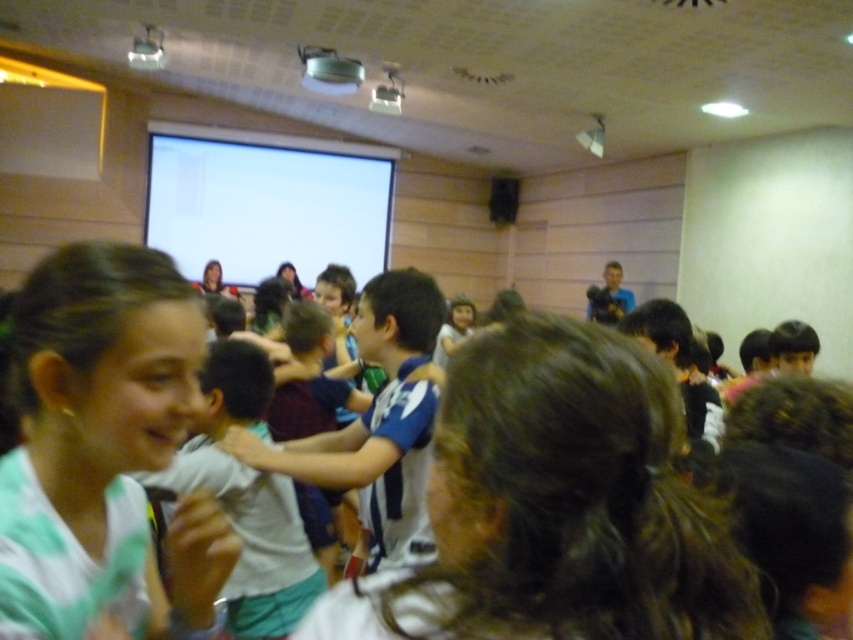
You are a photographer positioned at the back of the room. You want to take a photo of the matte black hair at upper center and the matte black hair at center without any obstruction. Which child should you move slightly forward to ensure both are visible?

You should move the matte black hair at center slightly forward so it is no longer behind the matte black hair at upper center, allowing both to be visible in the photo.

You are a photographer trying to capture a group photo of the children in the classroom. You notice two children with matte black hair at upper center and matte black hair at center. Which child has a wider head in the photo?

The matte black hair at center has a wider head in the photo since its width is greater than the matte black hair at upper center.